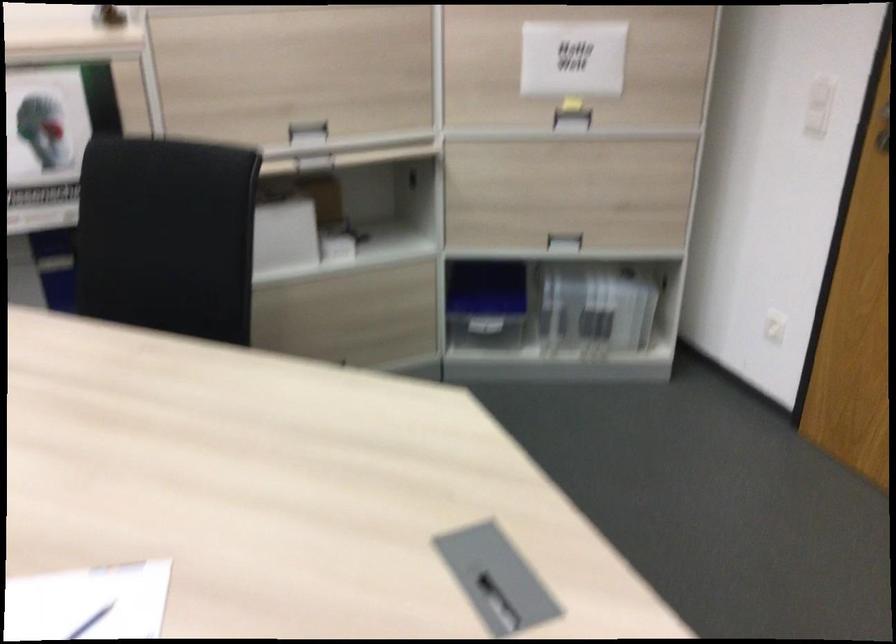
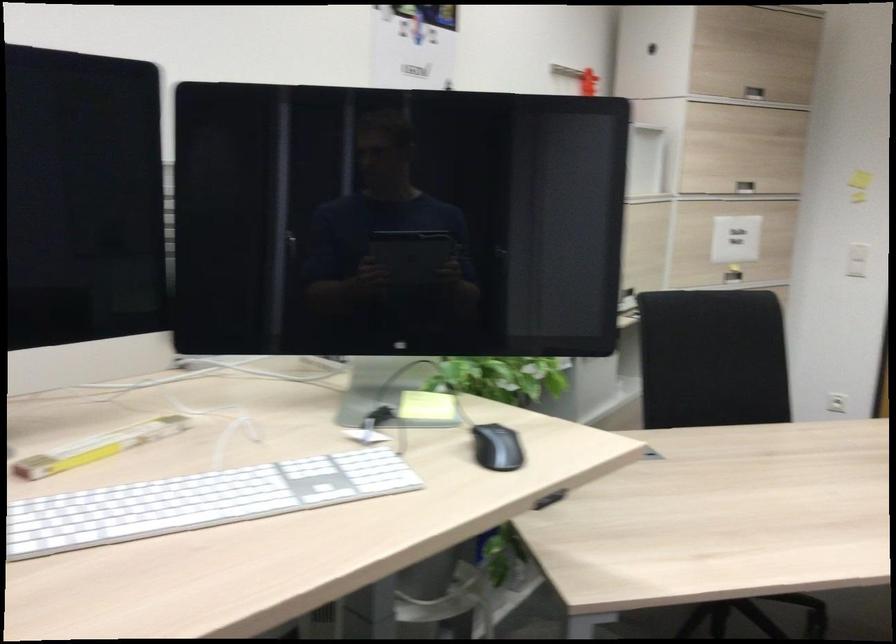
Question: I am providing you with two images of the same scene from different viewpoints. Which of the following objects are not visible in image2?

Choices:
 (A) white quilted cushion
 (B) white light switch
 (C) silver cabinet handle
 (D) blue plastic container

Answer: (D)